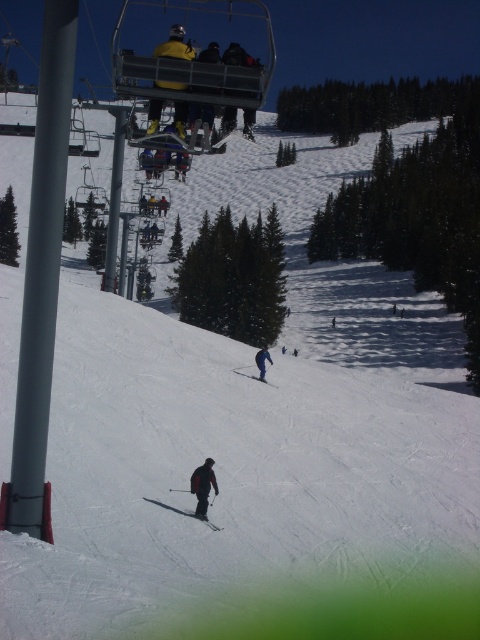
Question: Can you confirm if yellow fabric jacket at upper center is positioned below matte blue ski at center?

Choices:
 (A) no
 (B) yes

Answer: (A)

Question: Which object is closer to the camera taking this photo?

Choices:
 (A) matte blue ski at center
 (B) dark gray ski suit at lower center
 (C) black matte ski at lower center

Answer: (C)

Question: Which of the following is the closest to the observer?

Choices:
 (A) 237,371
 (B) 152,499
 (C) 199,488
 (D) 171,42

Answer: (D)

Question: Observing the image, what is the correct spatial positioning of dark gray ski suit at lower center in reference to blue fabric pants at lower center?

Choices:
 (A) right
 (B) left

Answer: (B)

Question: Does yellow fabric jacket at upper center have a larger size compared to matte blue ski at center?

Choices:
 (A) yes
 (B) no

Answer: (A)

Question: Which point appears farthest from the camera in this image?

Choices:
 (A) (172, 84)
 (B) (196, 516)
 (C) (200, 468)
 (D) (237, 372)

Answer: (D)